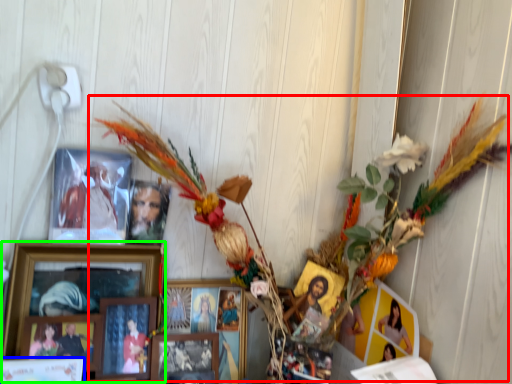
Question: Based on their relative distances, which object is farther from floral arrangement (highlighted by a red box)? Choose from picture frame (highlighted by a blue box) and picture frame (highlighted by a green box).

Choices:
 (A) picture frame
 (B) picture frame

Answer: (A)